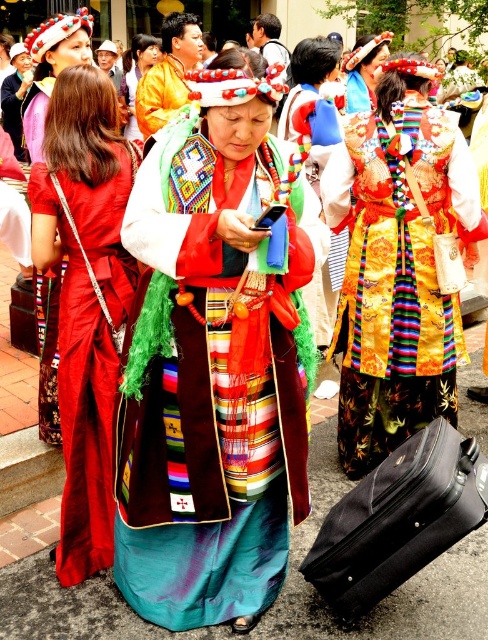
Is point (292, 202) positioned before point (357, 509)?

Yes, it is.

Based on the photo, between silky brocade dress at center and black fabric suitcase at lower right, which one is positioned higher?

silky brocade dress at center is higher up.

Describe the element at coordinates (215, 362) in the screenshot. I see `silky brocade dress at center` at that location.

At what (x,y) coordinates should I click in order to perform the action: click on silky brocade dress at center. Please return your answer as a coordinate pair (x, y). Looking at the image, I should click on (215, 362).

Is point (364, 387) less distant than point (85, 216)?

No, (364, 387) is further to viewer.

Is shiny gold dress at center closer to camera compared to silky red dress at center?

No, it is not.

Is point (432, 282) positioned after point (81, 564)?

Yes, point (432, 282) is behind point (81, 564).

Image resolution: width=488 pixels, height=640 pixels. I want to click on shiny gold dress at center, so click(398, 262).

Does silky brocade dress at center lie in front of silky red dress at center?

That is True.

Is silky brocade dress at center wider than silky red dress at center?

Indeed, silky brocade dress at center has a greater width compared to silky red dress at center.

I want to click on silky brocade dress at center, so click(x=215, y=362).

Where is `silky brocade dress at center`? The width and height of the screenshot is (488, 640). silky brocade dress at center is located at coordinates (215, 362).